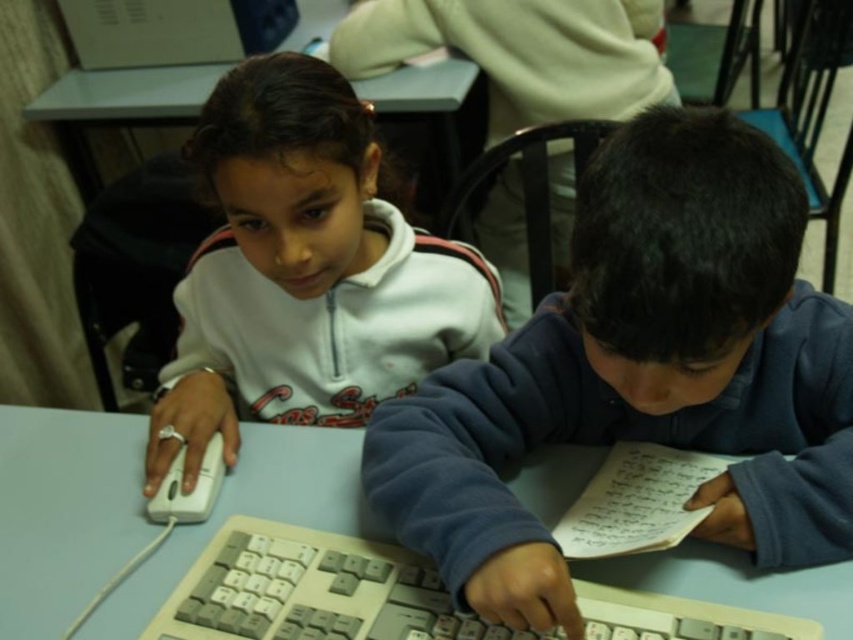
Does point (326, 465) come in front of point (728, 621)?

No, it is not.

Can you confirm if white plastic table at center is positioned to the left of gray plastic keyboard at center?

Correct, you'll find white plastic table at center to the left of gray plastic keyboard at center.

Identify the location of white plastic table at center. coord(64,512).

Is white plastic table at center taller than white matte mouse at lower left?

Yes, white plastic table at center is taller than white matte mouse at lower left.

Which is in front, point (155, 592) or point (169, 513)?

Point (155, 592) is in front.

Is point (193, 525) more distant than point (172, 513)?

Yes, it is.

The image size is (853, 640). I want to click on white plastic table at center, so click(64, 512).

Based on the photo, who is more forward, (544, 566) or (202, 512)?

Point (544, 566) is more forward.

Between dark blue fleece at center and white matte mouse at lower left, which one has more height?

With more height is dark blue fleece at center.

Is point (692, 307) farther from camera compared to point (175, 518)?

That is False.

The image size is (853, 640). I want to click on dark blue fleece at center, so click(x=641, y=372).